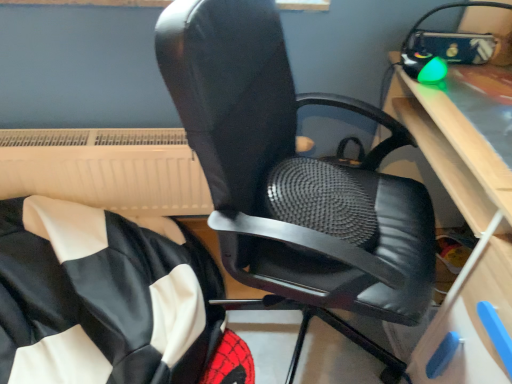
What is the approximate height of white plastic radiator at upper left?

It is 12.32 inches.

I want to click on black leather chair at center, so click(x=279, y=167).

In order to face black leather chair at center, should I rotate leftwards or rightwards?

Rotate right and turn 8.815 degrees.

Where is `white plastic radiator at upper left`? Image resolution: width=512 pixels, height=384 pixels. white plastic radiator at upper left is located at coordinates (106, 169).

Which object is further away from the camera, white plastic radiator at upper left or black leather chair at center?

white plastic radiator at upper left is further away from the camera.

Is white plastic radiator at upper left turned away from black leather chair at center?

No, white plastic radiator at upper left is not facing the opposite direction of black leather chair at center.

From a real-world perspective, is white plastic radiator at upper left positioned under black leather chair at center based on gravity?

Indeed, from a real-world perspective, white plastic radiator at upper left is positioned beneath black leather chair at center.

Considering the relative sizes of white plastic radiator at upper left and black leather chair at center in the image provided, is white plastic radiator at upper left smaller than black leather chair at center?

Yes, white plastic radiator at upper left is smaller than black leather chair at center.

Considering the sizes of white plastic radiator at upper left and light wood computer desk at right in the image, is white plastic radiator at upper left taller or shorter than light wood computer desk at right?

white plastic radiator at upper left is shorter than light wood computer desk at right.

From the image's perspective, is white plastic radiator at upper left located above light wood computer desk at right?

Yes, from the image's perspective, white plastic radiator at upper left is above light wood computer desk at right.

Considering the sizes of objects white plastic radiator at upper left and light wood computer desk at right in the image provided, who is smaller, white plastic radiator at upper left or light wood computer desk at right?

white plastic radiator at upper left is smaller.

Which object is more forward, black leather chair at center or light wood computer desk at right?

black leather chair at center is in front.

Is black leather chair at center turned away from light wood computer desk at right?

black leather chair at center is not turned away from light wood computer desk at right.

Which is closer to the camera, (258, 6) or (448, 313)?

Point (258, 6).

From the image's perspective, between black leather chair at center and light wood computer desk at right, which one is located above?

light wood computer desk at right.

Is light wood computer desk at right oriented away from black leather chair at center?

Yes.

Considering the sizes of light wood computer desk at right and black leather chair at center in the image, is light wood computer desk at right wider or thinner than black leather chair at center?

light wood computer desk at right is thinner than black leather chair at center.

From a real-world perspective, is light wood computer desk at right under black leather chair at center?

No.

Would you say black leather chair at center is a long distance from white plastic radiator at upper left?

No, there isn't a large distance between black leather chair at center and white plastic radiator at upper left.

Is the depth of black leather chair at center less than that of white plastic radiator at upper left?

Yes.

Considering the sizes of objects black leather chair at center and white plastic radiator at upper left in the image provided, who is taller, black leather chair at center or white plastic radiator at upper left?

With more height is black leather chair at center.

Between point (169, 57) and point (75, 146), which one is positioned behind?

The point (75, 146) is farther.

Who is shorter, light wood computer desk at right or white plastic radiator at upper left?

With less height is white plastic radiator at upper left.

Can you confirm if light wood computer desk at right is positioned to the right of white plastic radiator at upper left?

Yes.

Considering the relative sizes of light wood computer desk at right and white plastic radiator at upper left in the image provided, is light wood computer desk at right bigger than white plastic radiator at upper left?

Correct, light wood computer desk at right is larger in size than white plastic radiator at upper left.

Is point (473, 131) less distant than point (0, 168)?

Yes, it is.

Image resolution: width=512 pixels, height=384 pixels. What are the coordinates of `radiator located above the black leather chair at center (from the image's perspective)` in the screenshot? It's located at (106, 169).

Identify the location of computer desk below the white plastic radiator at upper left (from the image's perspective). The width and height of the screenshot is (512, 384). (473, 232).

From the image, which object appears to be farther from black leather chair at center, white plastic radiator at upper left or light wood computer desk at right?

white plastic radiator at upper left is further to black leather chair at center.

Considering their positions, is white plastic radiator at upper left positioned further to light wood computer desk at right than black leather chair at center?

The object further to light wood computer desk at right is white plastic radiator at upper left.

From the image, which object appears to be farther from light wood computer desk at right, black leather chair at center or white plastic radiator at upper left?

Based on the image, white plastic radiator at upper left appears to be further to light wood computer desk at right.

Estimate the real-world distances between objects in this image. Which object is closer to white plastic radiator at upper left, black leather chair at center or light wood computer desk at right?

black leather chair at center lies closer to white plastic radiator at upper left than the other object.

Which object lies nearer to the anchor point black leather chair at center, light wood computer desk at right or white plastic radiator at upper left?

light wood computer desk at right is closer to black leather chair at center.

Considering their positions, is light wood computer desk at right positioned closer to white plastic radiator at upper left than black leather chair at center?

The object closer to white plastic radiator at upper left is black leather chair at center.

Where is `chair between white plastic radiator at upper left and light wood computer desk at right in the horizontal direction`? This screenshot has width=512, height=384. chair between white plastic radiator at upper left and light wood computer desk at right in the horizontal direction is located at coordinates (279, 167).